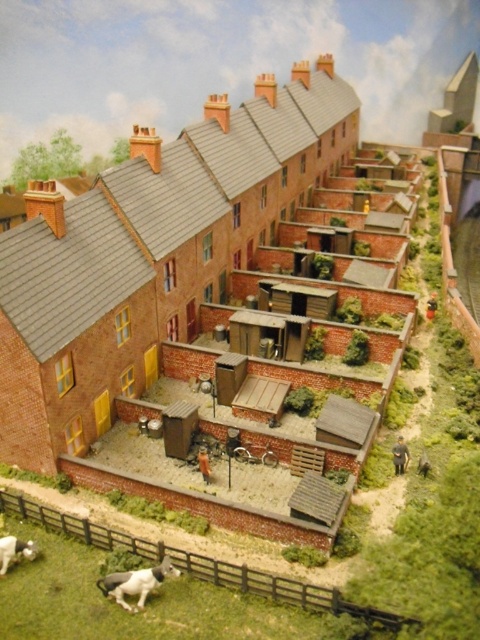
Can you confirm if white glossy horse at lower left is wider than white fur dog at lower left?

Yes, white glossy horse at lower left is wider than white fur dog at lower left.

Can you confirm if white glossy horse at lower left is taller than white fur dog at lower left?

Yes.

Find the location of a particular element. white glossy horse at lower left is located at coordinates (135, 582).

Image resolution: width=480 pixels, height=640 pixels. I want to click on white glossy horse at lower left, so click(x=135, y=582).